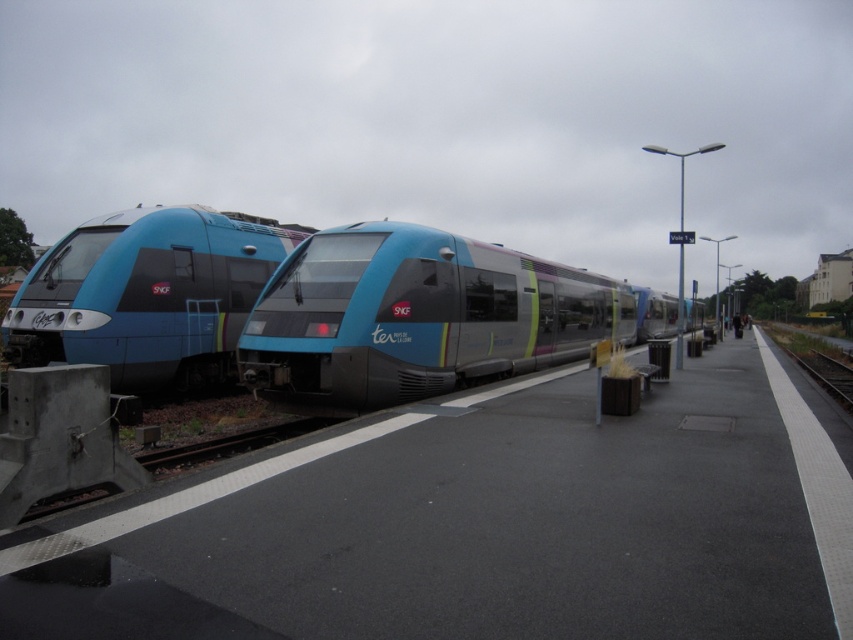
Based on the photo, you are standing at the entrance of the platform and want to board the metallic silver train at center. Which direction should you walk to reach it?

Since the metallic silver train at center is located at point coordinates of (416, 316), you should walk towards the center of the platform to reach it.